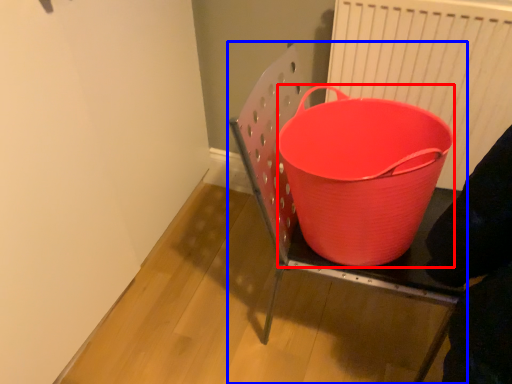
Question: Which point is closer to the camera, basket (highlighted by a red box) or furniture (highlighted by a blue box)?

Choices:
 (A) basket
 (B) furniture

Answer: (B)